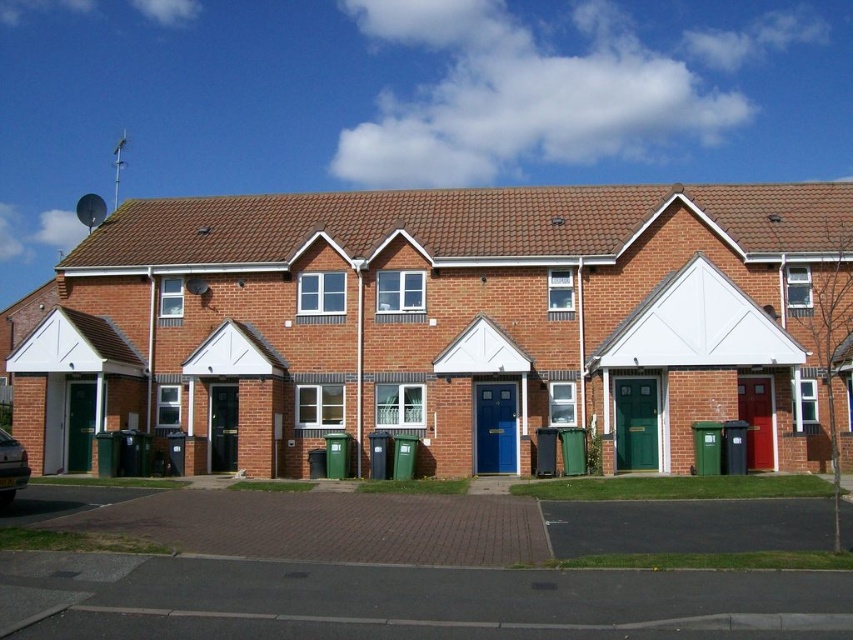
You are a delivery driver who needs to park your metallic silver car at lower left near the brick house at center. Considering the space between them, can you park the car close enough without touching the house?

The brick house at center might be wider than metallic silver car at lower left, so there might be enough space to park the car close without touching the house.

You are standing on the sidewalk in front of the row of brick houses. You see the brick house at center and the metallic silver car at lower left. Which object is closer to you?

The metallic silver car at lower left is closer to you because it is positioned under the brick house at center, indicating it is lower in the scene and thus nearer to the observer.